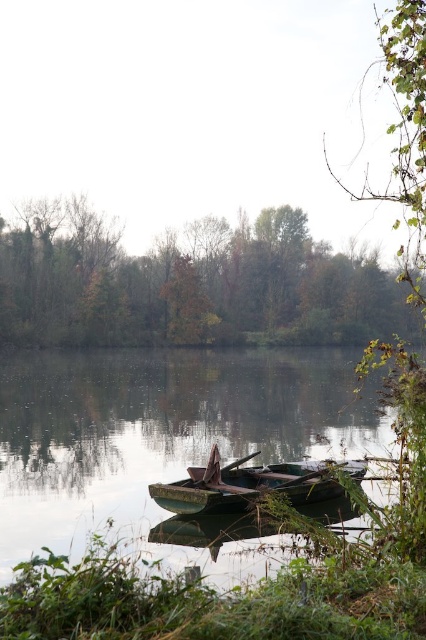
Is green matte boat at center positioned behind green leafy branch at upper right?

That is False.

Between green matte boat at center and green leafy branch at upper right, which one has less height?

With less height is green matte boat at center.

What do you see at coordinates (166, 444) in the screenshot? I see `green matte boat at center` at bounding box center [166, 444].

Find the location of `green matte boat at center`. green matte boat at center is located at coordinates (166, 444).

Who is positioned more to the right, green leafy tree at upper center or rusty metal boat at center?

Positioned to the right is rusty metal boat at center.

Which is above, green leafy tree at upper center or rusty metal boat at center?

green leafy tree at upper center is above.

Does point (284, 244) come closer to viewer compared to point (244, 458)?

No, it is not.

The height and width of the screenshot is (640, 426). I want to click on green leafy tree at upper center, so click(189, 284).

Is green matte boat at center behind green leafy tree at upper center?

No, it is in front of green leafy tree at upper center.

What do you see at coordinates (166, 444) in the screenshot? I see `green matte boat at center` at bounding box center [166, 444].

Where is `green matte boat at center`? Image resolution: width=426 pixels, height=640 pixels. green matte boat at center is located at coordinates (166, 444).